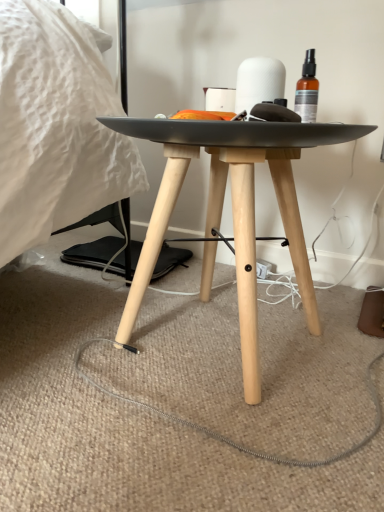
You are a GUI agent. You are given a task and a screenshot of the screen. Output one action in this format:
    pyautogui.click(x=<x>, y=<y>)
    Task: Click on the white matte toilet paper at center
    This screenshot has width=384, height=512.
    Given the screenshot: What is the action you would take?
    pyautogui.click(x=259, y=82)

This screenshot has width=384, height=512. What do you see at coordinates (259, 82) in the screenshot? I see `white matte toilet paper at center` at bounding box center [259, 82].

In the scene shown: In order to face white matte toilet paper at center, should I rotate leftwards or rightwards?

Turn right approximately 8.736 degrees to face it.

Find the location of `matte black table at center`. matte black table at center is located at coordinates coord(232,207).

The width and height of the screenshot is (384, 512). Describe the element at coordinates (232, 207) in the screenshot. I see `matte black table at center` at that location.

Identify the location of white matte toilet paper at center. (259, 82).

Considering the relative positions of white matte toilet paper at center and matte black table at center in the image provided, is white matte toilet paper at center to the left of matte black table at center from the viewer's perspective?

No, white matte toilet paper at center is not to the left of matte black table at center.

Is white matte toilet paper at center in front of or behind matte black table at center in the image?

white matte toilet paper at center is positioned farther from the viewer than matte black table at center.

Considering the positions of point (251, 91) and point (287, 234), is point (251, 91) closer or farther from the camera than point (287, 234)?

Clearly, point (251, 91) is closer to the camera than point (287, 234).

From the image's perspective, which is above, white matte toilet paper at center or matte black table at center?

white matte toilet paper at center.

From a real-world perspective, is white matte toilet paper at center over matte black table at center?

Yes, from a real-world perspective, white matte toilet paper at center is above matte black table at center.

Considering the sizes of white matte toilet paper at center and matte black table at center in the image, is white matte toilet paper at center wider or thinner than matte black table at center?

In the image, white matte toilet paper at center appears to be more narrow than matte black table at center.

Can you confirm if white matte toilet paper at center is taller than matte black table at center?

Incorrect, the height of white matte toilet paper at center is not larger of that of matte black table at center.

In terms of size, does white matte toilet paper at center appear bigger or smaller than matte black table at center?

white matte toilet paper at center is smaller than matte black table at center.

Is white matte toilet paper at center located outside matte black table at center?

That's correct, white matte toilet paper at center is outside of matte black table at center.

Would you say white matte toilet paper at center is a long distance from matte black table at center?

No, white matte toilet paper at center is not far from matte black table at center.

Is white matte toilet paper at center facing away from matte black table at center?

white matte toilet paper at center does not have its back to matte black table at center.

How different are the orientations of white matte toilet paper at center and matte black table at center in degrees?

The facing directions of white matte toilet paper at center and matte black table at center are 0.00122 degrees apart.

Find the location of a particular element. toilet paper behind the matte black table at center is located at coordinates (259, 82).

Would you say matte black table at center is to the left or to the right of white matte toilet paper at center in the picture?

Clearly, matte black table at center is on the left of white matte toilet paper at center in the image.

Relative to white matte toilet paper at center, is matte black table at center in front or behind?

Clearly, matte black table at center is in front of white matte toilet paper at center.

Between point (298, 133) and point (259, 67), which one is positioned in front?

The point (298, 133) is closer to the camera.

From the image's perspective, would you say matte black table at center is positioned over white matte toilet paper at center?

Actually, matte black table at center appears below white matte toilet paper at center in the image.

From a real-world perspective, is matte black table at center positioned over white matte toilet paper at center based on gravity?

No.

Which of these two, matte black table at center or white matte toilet paper at center, is wider?

matte black table at center is wider.

Does matte black table at center have a lesser height compared to white matte toilet paper at center?

Incorrect, the height of matte black table at center does not fall short of that of white matte toilet paper at center.

Considering the sizes of objects matte black table at center and white matte toilet paper at center in the image provided, who is smaller, matte black table at center or white matte toilet paper at center?

white matte toilet paper at center.

Is white matte toilet paper at center surrounded by matte black table at center?

No, white matte toilet paper at center is not a part of matte black table at center.

Is matte black table at center not near white matte toilet paper at center?

No, matte black table at center is in close proximity to white matte toilet paper at center.

Is matte black table at center facing towards white matte toilet paper at center?

No, matte black table at center is not oriented towards white matte toilet paper at center.

Based on the photo, can you tell me how much matte black table at center and white matte toilet paper at center differ in facing direction?

matte black table at center and white matte toilet paper at center are facing 0.00122 degrees away from each other.

The image size is (384, 512). I want to click on table below the white matte toilet paper at center (from the image's perspective), so click(x=232, y=207).

At what (x,y) coordinates should I click in order to perform the action: click on table lying on the left of white matte toilet paper at center. Please return your answer as a coordinate pair (x, y). The image size is (384, 512). Looking at the image, I should click on coord(232,207).

You are a GUI agent. You are given a task and a screenshot of the screen. Output one action in this format:
    pyautogui.click(x=<x>, y=<y>)
    Task: Click on the table in front of the white matte toilet paper at center
    The image size is (384, 512).
    Given the screenshot: What is the action you would take?
    pyautogui.click(x=232, y=207)